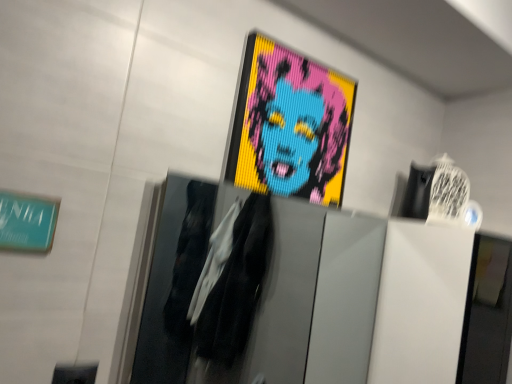
Question: Looking at the image, does teal matte sign at upper left seem bigger or smaller compared to pixelated colorful portrait at upper center?

Choices:
 (A) small
 (B) big

Answer: (A)

Question: Considering the relative positions of teal matte sign at upper left and pixelated colorful portrait at upper center in the image provided, is teal matte sign at upper left to the left or to the right of pixelated colorful portrait at upper center?

Choices:
 (A) right
 (B) left

Answer: (B)

Question: Is teal matte sign at upper left inside or outside of pixelated colorful portrait at upper center?

Choices:
 (A) inside
 (B) outside

Answer: (B)

Question: Is pixelated colorful portrait at upper center in front of or behind teal matte sign at upper left in the image?

Choices:
 (A) front
 (B) behind

Answer: (B)

Question: Is pixelated colorful portrait at upper center bigger or smaller than teal matte sign at upper left?

Choices:
 (A) small
 (B) big

Answer: (B)

Question: Does point (267, 104) appear closer or farther from the camera than point (37, 236)?

Choices:
 (A) farther
 (B) closer

Answer: (A)

Question: From a real-world perspective, is pixelated colorful portrait at upper center above or below teal matte sign at upper left?

Choices:
 (A) below
 (B) above

Answer: (B)